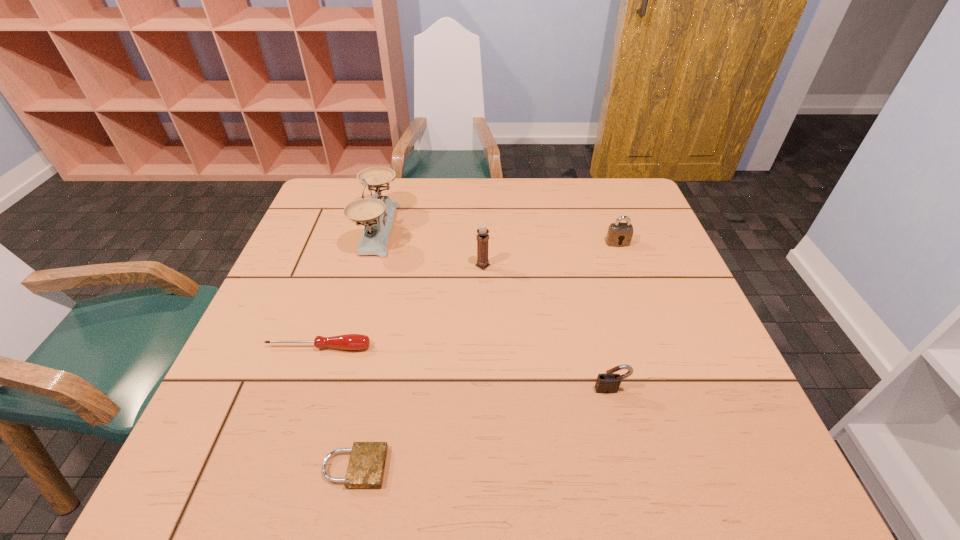
You are a GUI agent. You are given a task and a screenshot of the screen. Output one action in this format:
    pyautogui.click(x=<x>, y=<y>)
    Task: Click on the tallest object
    The width and height of the screenshot is (960, 540).
    Given the screenshot: What is the action you would take?
    coord(378,211)

This screenshot has height=540, width=960. I want to click on the fourth nearest object, so click(x=482, y=238).

The image size is (960, 540). I want to click on the second tallest object, so click(482, 238).

This screenshot has width=960, height=540. Find the location of `the rightmost padlock`. the rightmost padlock is located at coordinates (619, 234).

Where is `the farthest padlock`? The height and width of the screenshot is (540, 960). the farthest padlock is located at coordinates (619, 234).

Locate an element on the screen. Image resolution: width=960 pixels, height=540 pixels. the second padlock from right to left is located at coordinates (607, 383).

Identify the location of the second nearest object. (607, 383).

Where is `the fifth tallest object`? This screenshot has width=960, height=540. the fifth tallest object is located at coordinates (348, 341).

Image resolution: width=960 pixels, height=540 pixels. I want to click on screwdriver, so click(x=348, y=341).

Where is `the shortest object`? the shortest object is located at coordinates (367, 461).